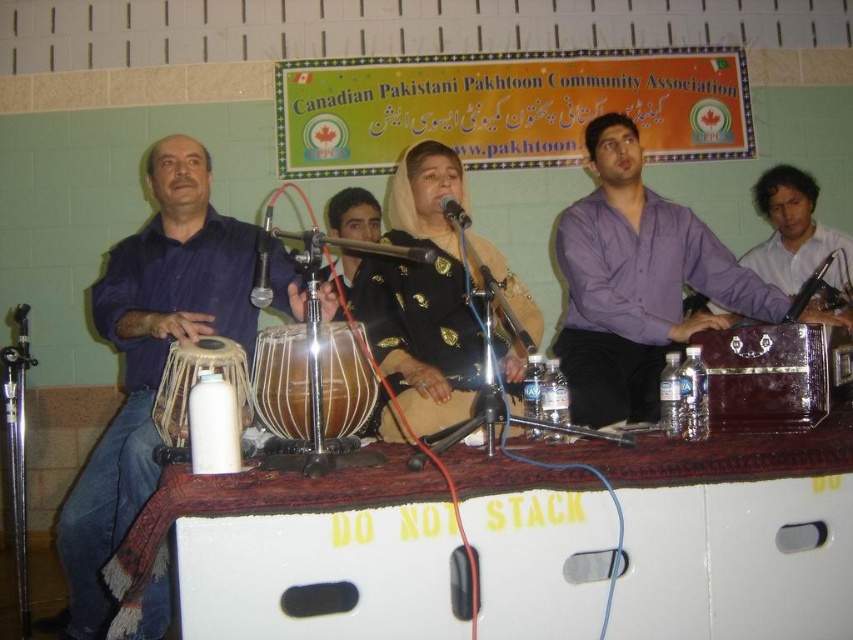
Is purple shiny suitcase at center thinner than wooden drum at center?

In fact, purple shiny suitcase at center might be wider than wooden drum at center.

Does purple shiny suitcase at center have a greater height compared to wooden drum at center?

Yes.

Describe the element at coordinates (637, 282) in the screenshot. I see `purple shiny suitcase at center` at that location.

Where is `purple shiny suitcase at center`? This screenshot has width=853, height=640. purple shiny suitcase at center is located at coordinates (637, 282).

Which is below, black satin dress at center or light brown wooden drum at left?

light brown wooden drum at left is below.

Measure the distance from black satin dress at center to light brown wooden drum at left.

black satin dress at center is 21.70 inches away from light brown wooden drum at left.

Is point (424, 214) positioned before point (189, 342)?

No, it is not.

Where is `black satin dress at center`? This screenshot has width=853, height=640. black satin dress at center is located at coordinates (422, 298).

Is black satin dress at center positioned behind wooden drum at center?

Yes, it is behind wooden drum at center.

What do you see at coordinates (422, 298) in the screenshot? The image size is (853, 640). I see `black satin dress at center` at bounding box center [422, 298].

Who is more forward, (x=416, y=184) or (x=273, y=339)?

Point (x=273, y=339)

Find the location of a particular element. The height and width of the screenshot is (640, 853). black satin dress at center is located at coordinates (422, 298).